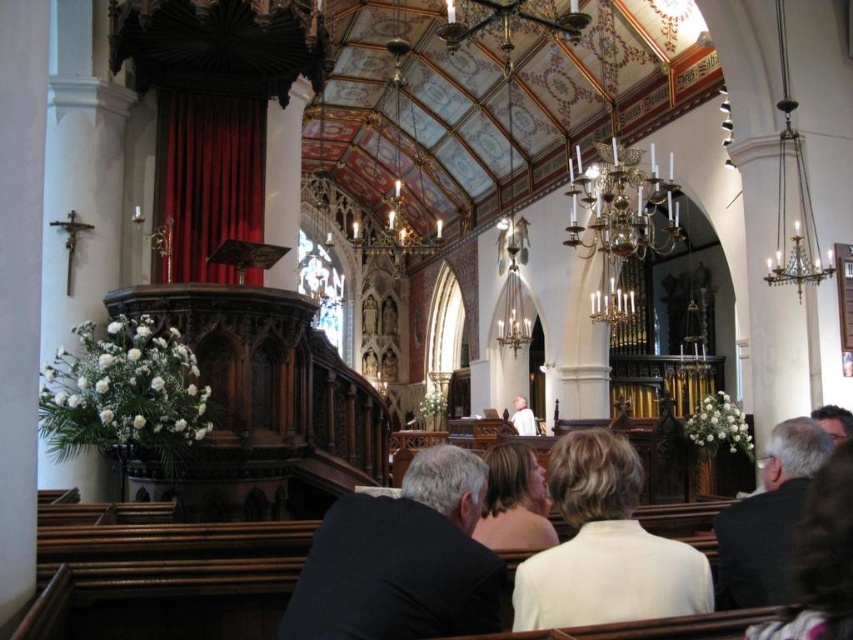
Looking at this image, measure the distance between point (331, 568) and camera.

A distance of 16.81 meters exists between point (331, 568) and camera.

Who is lower down, black fabric at center or white fabric at center?

white fabric at center is lower down.

This screenshot has width=853, height=640. What are the coordinates of `black fabric at center` in the screenshot? It's located at (401, 561).

Based on the photo, between white matte jacket at lower center and white fabric at center, which one appears on the right side from the viewer's perspective?

white fabric at center is more to the right.

Can you confirm if white matte jacket at lower center is thinner than white fabric at center?

Incorrect, white matte jacket at lower center's width is not less than white fabric at center's.

Image resolution: width=853 pixels, height=640 pixels. I want to click on white matte jacket at lower center, so click(605, 547).

Which of these two, black fabric at center or white matte jacket at lower center, stands shorter?

black fabric at center

Can you confirm if black fabric at center is positioned to the right of white matte jacket at lower center?

No, black fabric at center is not to the right of white matte jacket at lower center.

What do you see at coordinates (401, 561) in the screenshot? The width and height of the screenshot is (853, 640). I see `black fabric at center` at bounding box center [401, 561].

Locate an element on the screen. The image size is (853, 640). black fabric at center is located at coordinates (401, 561).